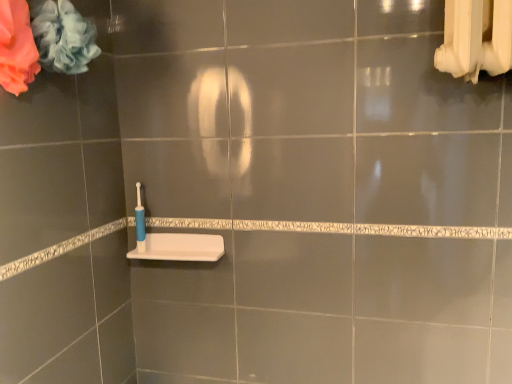
Identify the location of vacant area that lies to the right of blue plastic toothbrush at lower left. (179, 249).